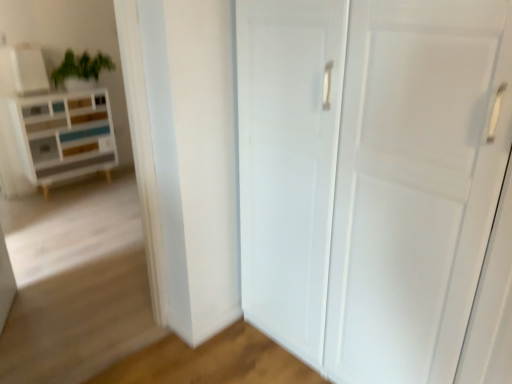
Where is `wooden/multicolored drawer at left`? This screenshot has width=512, height=384. wooden/multicolored drawer at left is located at coordinates (49, 126).

The height and width of the screenshot is (384, 512). Describe the element at coordinates (49, 126) in the screenshot. I see `wooden/multicolored drawer at left` at that location.

The height and width of the screenshot is (384, 512). Identify the location of wooden/multicolored drawer at left. (49, 126).